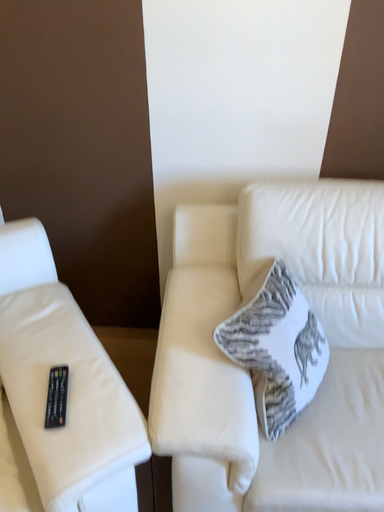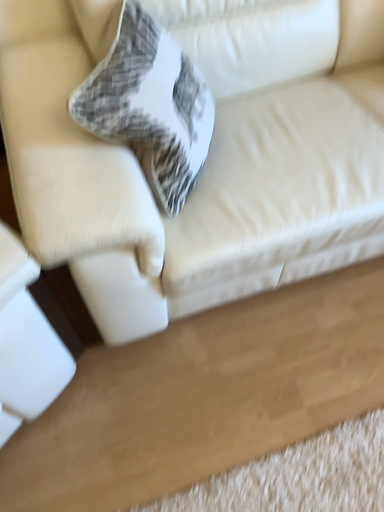
Question: How did the camera likely rotate when shooting the video?

Choices:
 (A) rotated right
 (B) rotated left

Answer: (A)